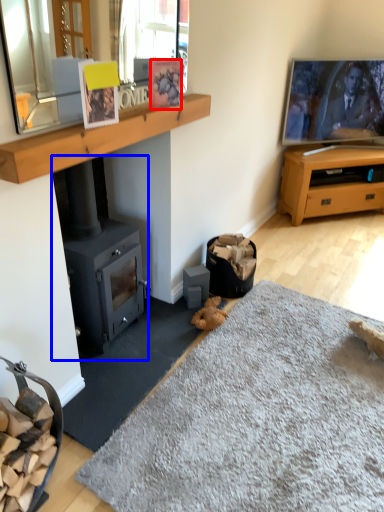
Question: Among these objects, which one is nearest to the camera, picture frame (highlighted by a red box) or wood burning stove (highlighted by a blue box)?

Choices:
 (A) picture frame
 (B) wood burning stove

Answer: (B)